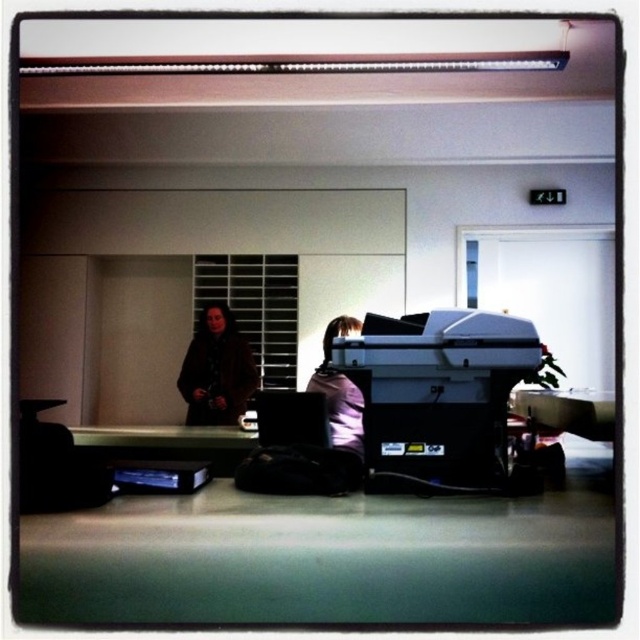
Between matte black printer at center and brown leather jacket at center, which one has less height?

With less height is matte black printer at center.

Who is higher up, matte black printer at center or brown leather jacket at center?

matte black printer at center

Between point (392, 339) and point (212, 301), which one is positioned behind?

Point (212, 301)

Image resolution: width=640 pixels, height=640 pixels. What are the coordinates of `matte black printer at center` in the screenshot? It's located at (436, 397).

Can you confirm if matte black printer at center is shorter than black plastic printer at center?

No.

What do you see at coordinates (436, 397) in the screenshot? I see `matte black printer at center` at bounding box center [436, 397].

The image size is (640, 640). What are the coordinates of `matte black printer at center` in the screenshot? It's located at (436, 397).

Who is lower down, brown leather jacket at center or black plastic printer at center?

black plastic printer at center is lower down.

Looking at this image, who is more forward, [236,413] or [280,390]?

Point [236,413]

This screenshot has height=640, width=640. Describe the element at coordinates (216, 371) in the screenshot. I see `brown leather jacket at center` at that location.

Identify the location of brown leather jacket at center. (216, 371).